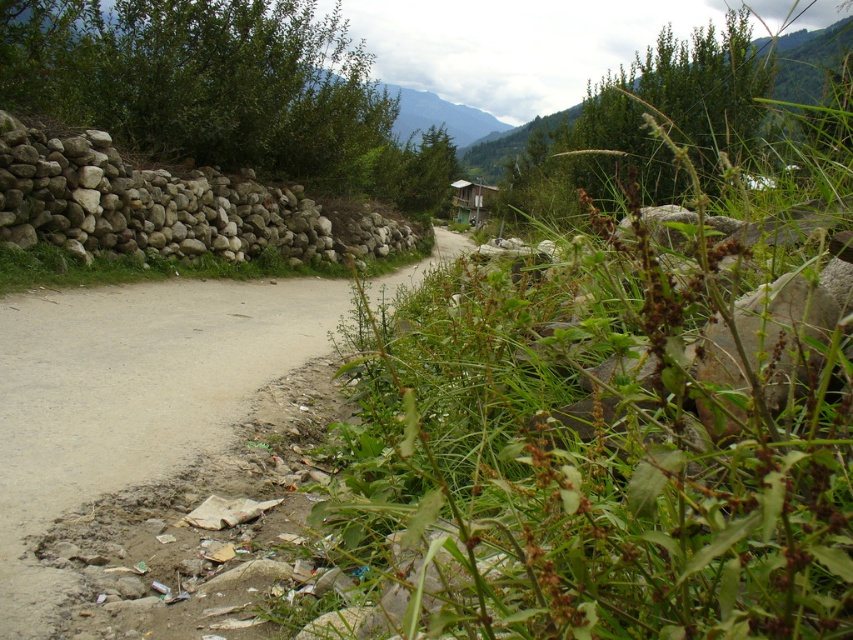
Looking at this image, who is shorter, green textured mountain at upper center or wooden hut at center?

wooden hut at center

Where is `green textured mountain at upper center`? This screenshot has height=640, width=853. green textured mountain at upper center is located at coordinates (440, 116).

Where is `green textured mountain at upper center`? green textured mountain at upper center is located at coordinates (440, 116).

Which is above, white rock wall at left or green textured mountain at upper center?

Positioned higher is green textured mountain at upper center.

Based on the photo, does white rock wall at left appear on the right side of green textured mountain at upper center?

In fact, white rock wall at left is to the left of green textured mountain at upper center.

What do you see at coordinates (165, 205) in the screenshot? The width and height of the screenshot is (853, 640). I see `white rock wall at left` at bounding box center [165, 205].

Identify the location of white rock wall at left. This screenshot has height=640, width=853. (165, 205).

Between brown dirt road at left and wooden hut at center, which one appears on the right side from the viewer's perspective?

wooden hut at center is more to the right.

Who is higher up, brown dirt road at left or wooden hut at center?

wooden hut at center is higher up.

Locate an element on the screen. The width and height of the screenshot is (853, 640). brown dirt road at left is located at coordinates (129, 396).

This screenshot has height=640, width=853. Identify the location of brown dirt road at left. click(129, 396).